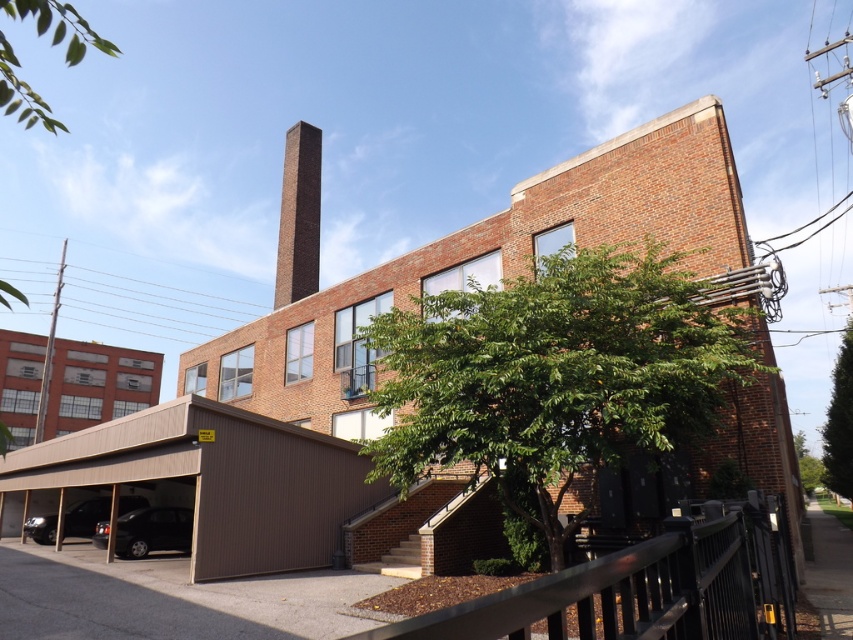
You are standing at the entrance of the building and want to locate two specific points marked in the image. Which of the two points, point (x=483, y=444) or point (x=44, y=125), is closer to your current position?

Point (x=44, y=125) is closer to your current position at the entrance because it is less further away from the camera compared to point (x=483, y=444).

You are a delivery person trying to park your vehicle in the covered parking area. The parking area has a height restriction of 2 meters. You have a truck that is 2.1 meters tall. Can you determine if your truck will fit under the corrugated metal roof of the covered parking area based on the size comparison between the brown brick building at center and the brick chimney at upper center?

The brown brick building at center is larger in size compared to the brick chimney at upper center. However, the height restriction of the parking area is not directly related to the size of the building or chimney. Without specific height measurements for the parking roof, it is impossible to determine if the truck will fit.